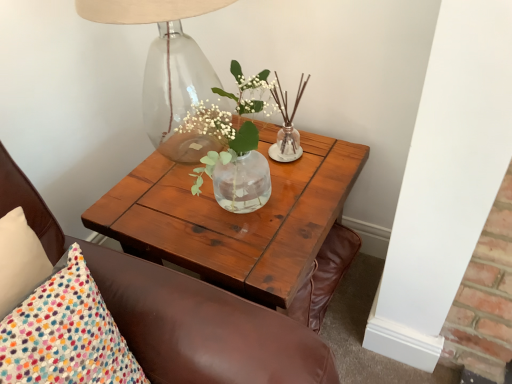
Question: Is brown leather chair at upper left located outside wooden coffee table at center?

Choices:
 (A) no
 (B) yes

Answer: (B)

Question: Is wooden coffee table at center surrounded by brown leather chair at upper left?

Choices:
 (A) yes
 (B) no

Answer: (B)

Question: Can you confirm if brown leather chair at upper left is thinner than wooden coffee table at center?

Choices:
 (A) no
 (B) yes

Answer: (B)

Question: Does brown leather chair at upper left have a smaller size compared to wooden coffee table at center?

Choices:
 (A) no
 (B) yes

Answer: (B)

Question: Is brown leather chair at upper left further to camera compared to wooden coffee table at center?

Choices:
 (A) no
 (B) yes

Answer: (A)

Question: Can you confirm if brown leather chair at upper left is taller than wooden coffee table at center?

Choices:
 (A) yes
 (B) no

Answer: (A)

Question: Is transparent glass table lamp at upper left shorter than wooden coffee table at center?

Choices:
 (A) yes
 (B) no

Answer: (A)

Question: From a real-world perspective, is transparent glass table lamp at upper left positioned over wooden coffee table at center based on gravity?

Choices:
 (A) yes
 (B) no

Answer: (A)

Question: Considering the relative sizes of transparent glass table lamp at upper left and wooden coffee table at center in the image provided, is transparent glass table lamp at upper left taller than wooden coffee table at center?

Choices:
 (A) no
 (B) yes

Answer: (A)

Question: Does transparent glass table lamp at upper left have a greater width compared to wooden coffee table at center?

Choices:
 (A) no
 (B) yes

Answer: (A)

Question: Is transparent glass table lamp at upper left not within wooden coffee table at center?

Choices:
 (A) no
 (B) yes

Answer: (B)

Question: Does transparent glass table lamp at upper left lie behind wooden coffee table at center?

Choices:
 (A) no
 (B) yes

Answer: (A)

Question: Does transparent glass table lamp at upper left have a lesser width compared to brown leather chair at upper left?

Choices:
 (A) yes
 (B) no

Answer: (B)